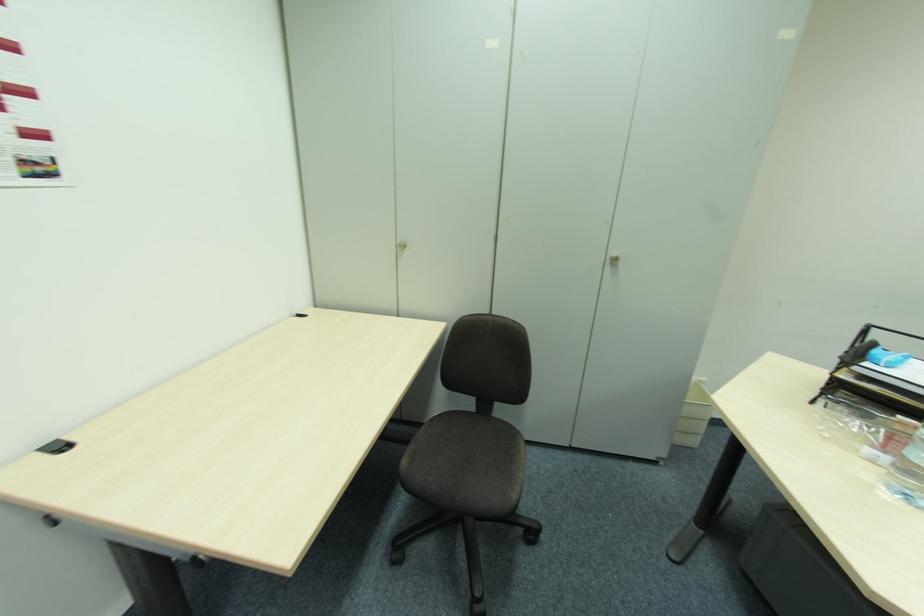
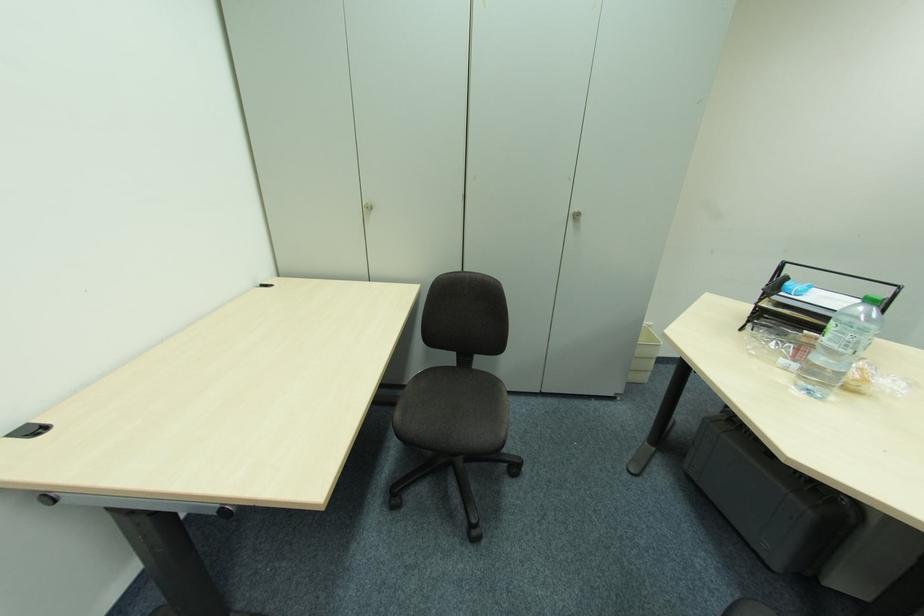
Locate, in the second image, the point that corresponds to (x=495, y=418) in the first image.

(477, 371)